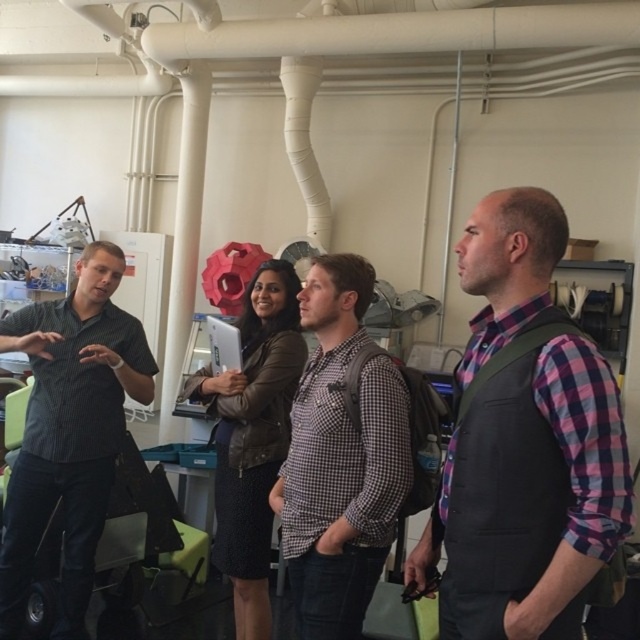
Question: Which point is closer to the camera?

Choices:
 (A) dark gray button-down shirt at left
 (B) checkered fabric shirt at center

Answer: (B)

Question: Estimate the real-world distances between objects in this image. Which object is farther from the dark gray button-down shirt at left?

Choices:
 (A) checkered fabric shirt at center
 (B) plaid fabric shirt at center

Answer: (B)

Question: Does checkered fabric shirt at center appear under dark gray button-down shirt at left?

Choices:
 (A) no
 (B) yes

Answer: (A)

Question: Among these objects, which one is farthest from the camera?

Choices:
 (A) plaid fabric shirt at center
 (B) dark gray button-down shirt at left
 (C) checkered fabric shirt at center

Answer: (B)

Question: Does checkered fabric shirt at center appear on the right side of dark gray button-down shirt at left?

Choices:
 (A) no
 (B) yes

Answer: (B)

Question: Does plaid fabric shirt at center appear over dark gray button-down shirt at left?

Choices:
 (A) yes
 (B) no

Answer: (A)